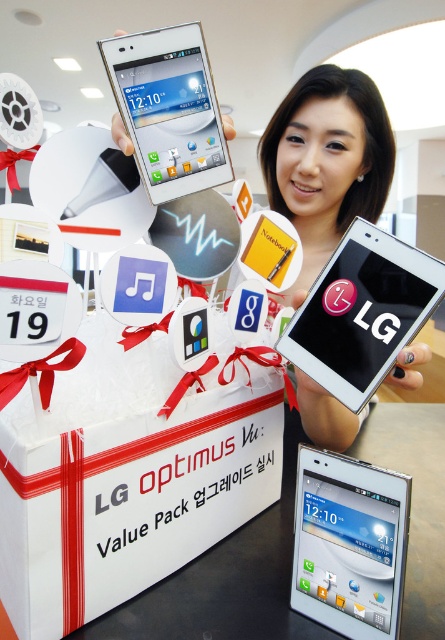
You are a customer at an electronics store and see two devices, a white glossy smartphone at center and a white glossy phone at center, displayed on a table. Which one is taller?

The white glossy smartphone at center is taller than the white glossy phone at center.

You are a delivery person who needs to place the white cardboard box at center and the white glossy smartphone at center into a delivery box that has a maximum length of 10 inches. Can both items fit side by side in the delivery box?

The distance between the white cardboard box at center and the white glossy smartphone at center is 7.05 inches, so yes, both items can fit side by side in the delivery box since their combined length is less than the 10 inch maximum.

You are standing in front of the LG Optimus Vu Value Pack display. There are two points marked on the display box. The first point is at coordinates point (126, 576) and the second point is at point (343, 572). Which point is closer to you?

Point (126, 576) is further to the camera than point (343, 572), so the point closer to you is point (343, 572).